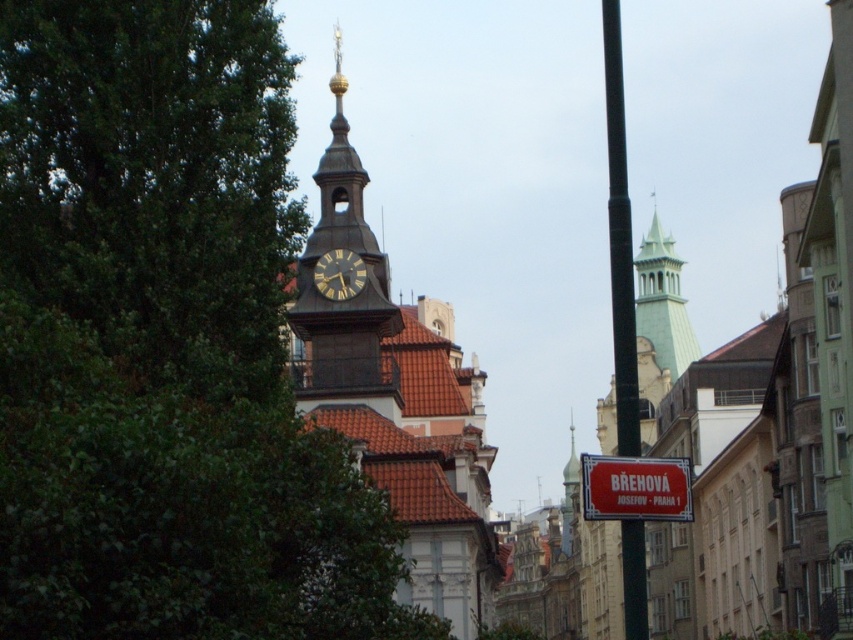
You are a tourist standing on the street looking at the dark brown stone clock tower at center and the green glass spire at upper right. Which object is closer to you based on their positions?

The dark brown stone clock tower at center is closer to you because it is positioned over the green glass spire at upper right, indicating it is in front.

You are a tourist standing at the base of the dark brown stone clock tower at center and want to take a photo of the green glass spire at upper right. Given that the camera you have can focus on objects up to 120 meters away, will you be able to capture a clear image of the spire?

The dark brown stone clock tower at center and the green glass spire at upper right are 118.15 meters apart. Since the camera can focus up to 120 meters, the distance is within range, so yes, you can capture a clear image of the green glass spire at upper right.